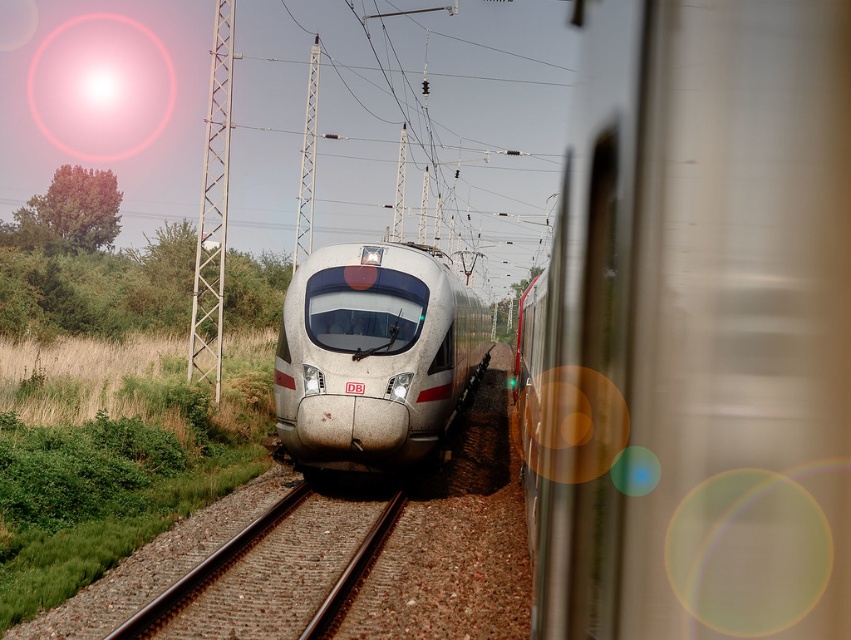
Is metallic train at center bigger than silver metallic bullet train at center?

Actually, metallic train at center might be smaller than silver metallic bullet train at center.

Which is in front, point (581, 84) or point (381, 291)?

Point (581, 84) is more forward.

Locate an element on the screen. This screenshot has height=640, width=851. metallic train at center is located at coordinates (700, 326).

Does point (390, 339) come farther from viewer compared to point (375, 330)?

No, (390, 339) is in front of (375, 330).

Is point (301, 356) less distant than point (375, 285)?

Yes, point (301, 356) is closer to viewer.

This screenshot has height=640, width=851. What are the coordinates of `silver metallic bullet train at center` in the screenshot? It's located at (373, 355).

Is metallic train at center thinner than transparent glass train window at center?

Correct, metallic train at center's width is less than transparent glass train window at center's.

Who is more distant from viewer, (551, 284) or (333, 300)?

Positioned behind is point (333, 300).

The image size is (851, 640). What do you see at coordinates (700, 326) in the screenshot?
I see `metallic train at center` at bounding box center [700, 326].

Where is `metallic train at center`? The image size is (851, 640). metallic train at center is located at coordinates (700, 326).